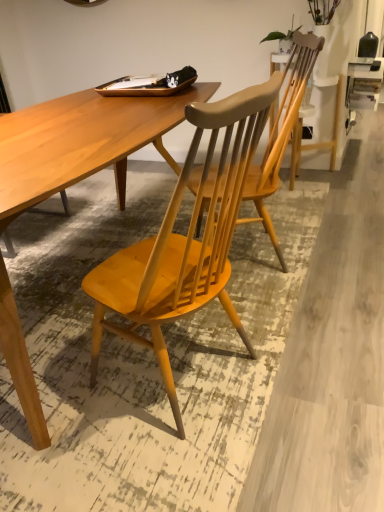
Question: Is matte wood chair at center facing away from light brown wood desk at center?

Choices:
 (A) yes
 (B) no

Answer: (B)

Question: Can you confirm if matte wood chair at center is smaller than light brown wood desk at center?

Choices:
 (A) no
 (B) yes

Answer: (B)

Question: Does matte wood chair at center have a lesser width compared to light brown wood desk at center?

Choices:
 (A) no
 (B) yes

Answer: (B)

Question: Does matte wood chair at center have a lesser height compared to light brown wood desk at center?

Choices:
 (A) yes
 (B) no

Answer: (B)

Question: Does matte wood chair at center have a greater width compared to light brown wood desk at center?

Choices:
 (A) no
 (B) yes

Answer: (A)

Question: From a real-world perspective, is matte wood chair at center positioned under light brown wood desk at center based on gravity?

Choices:
 (A) no
 (B) yes

Answer: (A)

Question: Is light brown wood desk at center in front of matte wood chair at center?

Choices:
 (A) yes
 (B) no

Answer: (A)

Question: Considering the relative sizes of light brown wood desk at center and matte wood chair at center in the image provided, is light brown wood desk at center bigger than matte wood chair at center?

Choices:
 (A) no
 (B) yes

Answer: (B)

Question: Considering the relative positions of light brown wood desk at center and matte wood chair at center in the image provided, is light brown wood desk at center to the right of matte wood chair at center from the viewer's perspective?

Choices:
 (A) yes
 (B) no

Answer: (B)

Question: Considering the relative positions of light brown wood desk at center and matte wood chair at center in the image provided, is light brown wood desk at center behind matte wood chair at center?

Choices:
 (A) no
 (B) yes

Answer: (A)

Question: Is light brown wood desk at center positioned far away from matte wood chair at center?

Choices:
 (A) no
 (B) yes

Answer: (A)

Question: Does light brown wood desk at center contain matte wood chair at center?

Choices:
 (A) no
 (B) yes

Answer: (A)

Question: Based on their sizes in the image, would you say matte wood chair at center is bigger or smaller than light brown wood desk at center?

Choices:
 (A) big
 (B) small

Answer: (B)